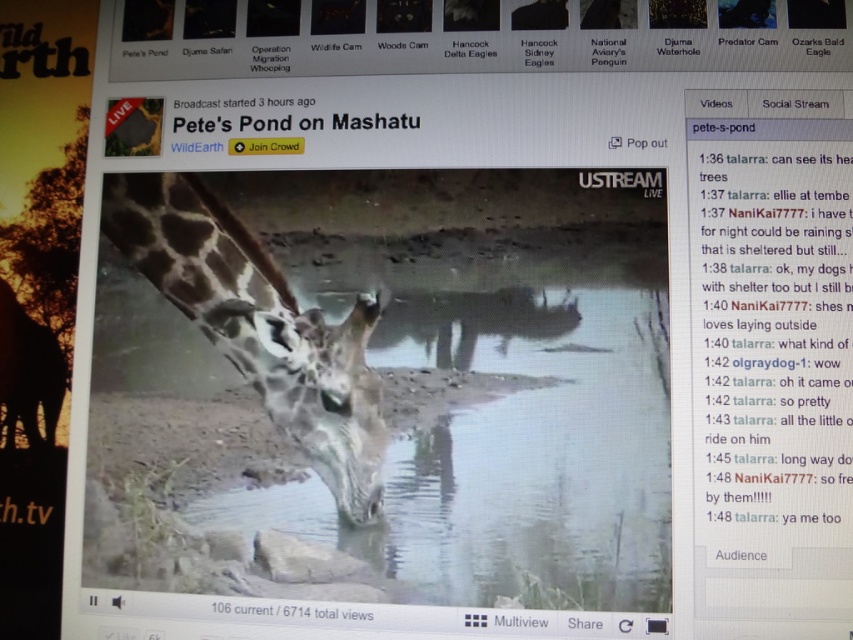
Is clear water at center taller than spotted fur giraffe at center?

In fact, clear water at center may be shorter than spotted fur giraffe at center.

Is point (459, 333) less distant than point (299, 440)?

Yes, it is in front of point (299, 440).

I want to click on clear water at center, so click(x=532, y=454).